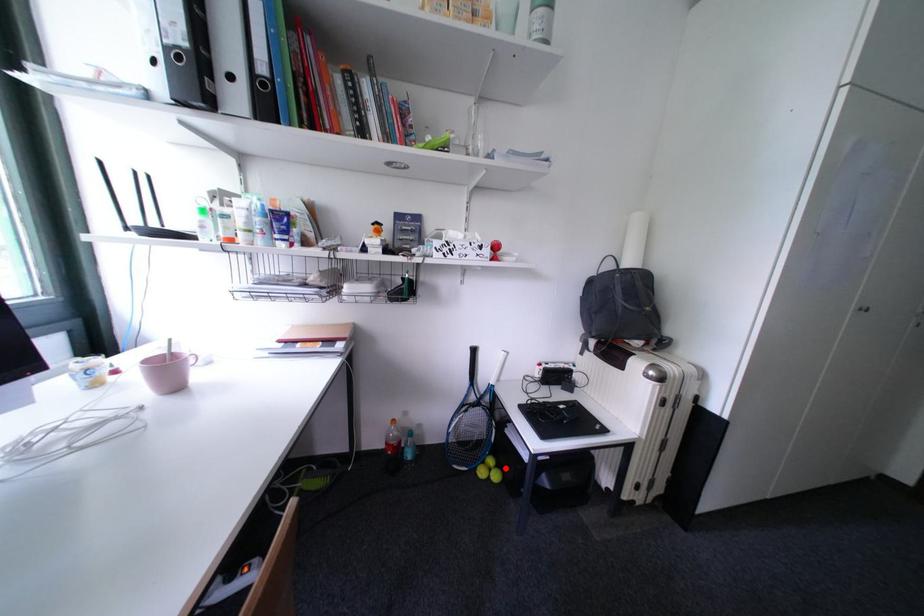
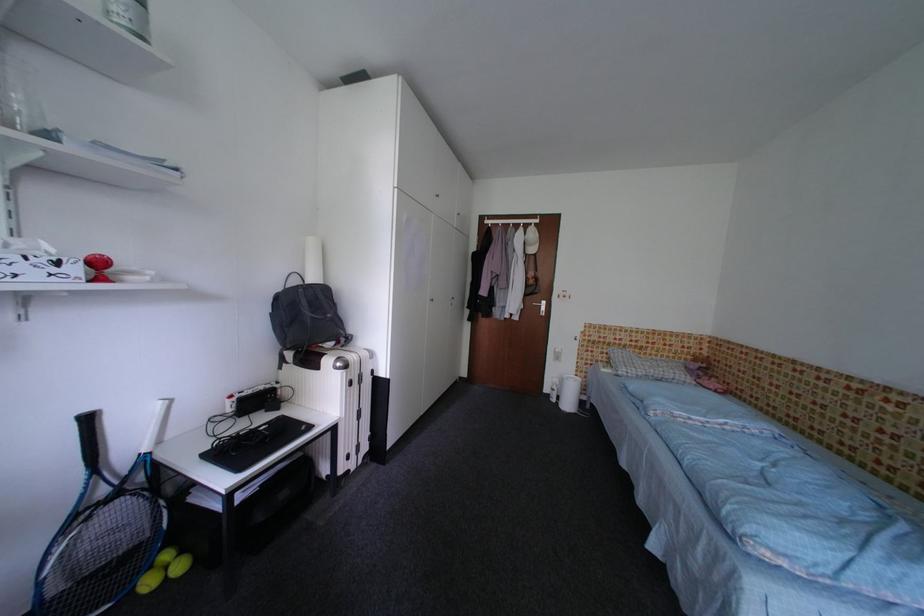
Question: A red point is marked in image1. In image2, is the corresponding 3D point closer to the camera or farther? Reply with the corresponding letter.

Choices:
 (A) The corresponding 3D point is closer.
 (B) The corresponding 3D point is farther.

Answer: (A)